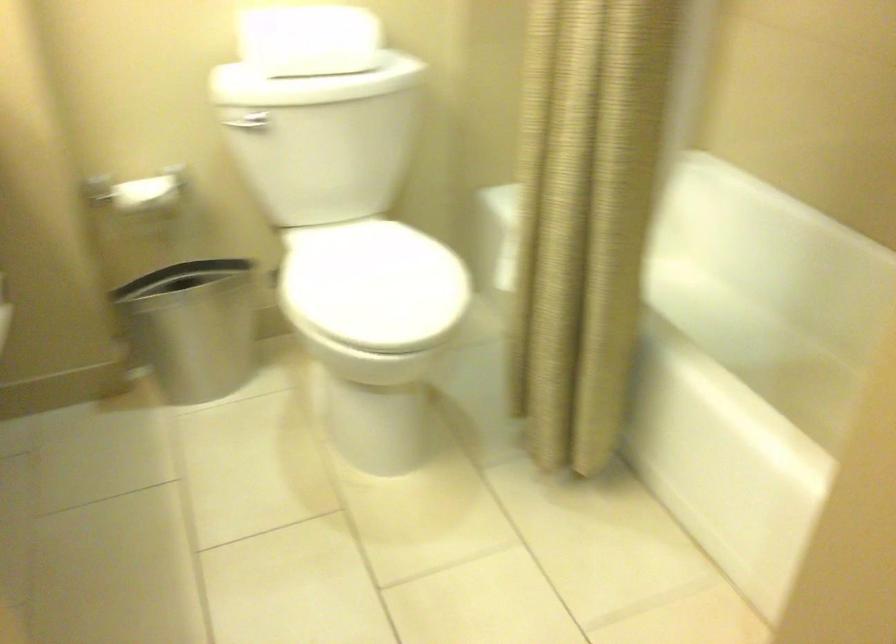
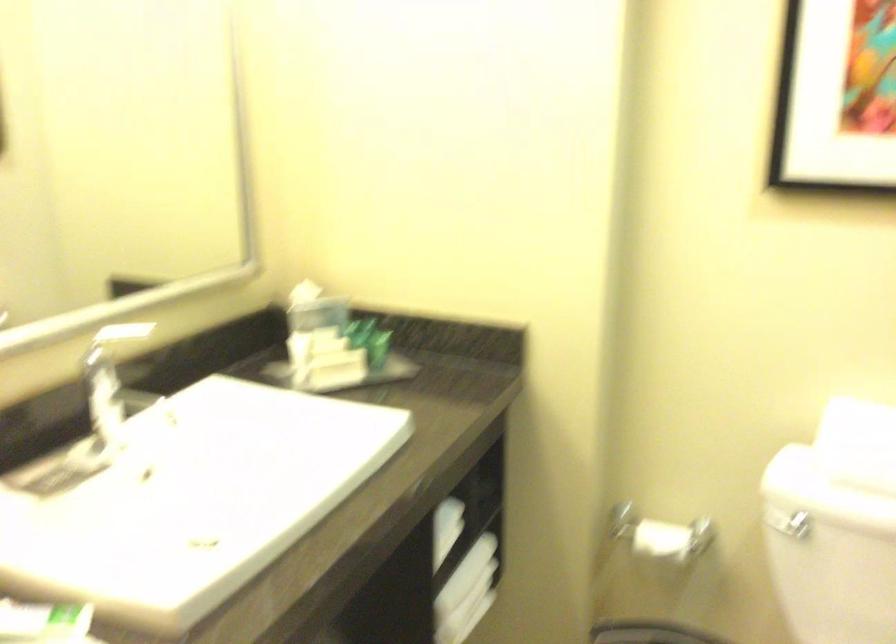
Find the pixel in the second image that matches point (143, 190) in the first image.

(660, 540)